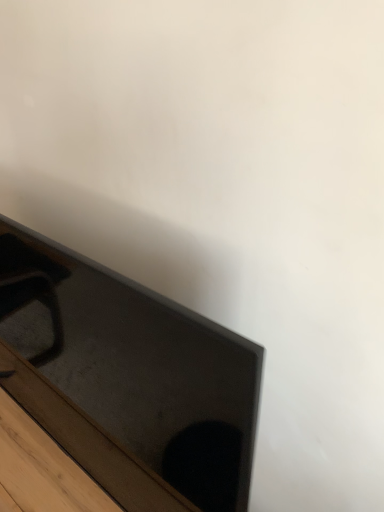
In order to face matte black tv at lower left, should I rotate leftwards or rightwards?

To face it directly, rotate left by 18.500 degrees.

I want to click on matte black tv at lower left, so click(129, 378).

The image size is (384, 512). Describe the element at coordinates (129, 378) in the screenshot. I see `matte black tv at lower left` at that location.

This screenshot has width=384, height=512. In order to click on matte black tv at lower left in this screenshot , I will do coord(129,378).